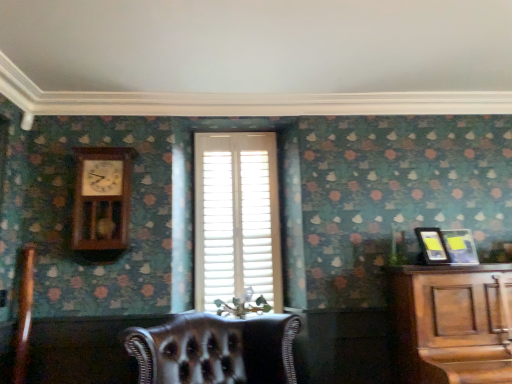
Where is `leather armchair at lower left`? Image resolution: width=512 pixels, height=384 pixels. leather armchair at lower left is located at coordinates (24, 316).

The width and height of the screenshot is (512, 384). In order to click on matte black picture frame at right, which is counted as the second picture frame, starting from the right in this screenshot , I will do `click(432, 246)`.

What is the approximate width of white wood blinds at center?

2.74 inches.

What is the approximate width of metallic silver picture frame at right, the second picture frame in the left-to-right sequence?

The width of metallic silver picture frame at right, the second picture frame in the left-to-right sequence, is 6.14 inches.

Where is `leather at center`? The width and height of the screenshot is (512, 384). leather at center is located at coordinates (215, 350).

What do you see at coordinates (102, 198) in the screenshot?
I see `wooden pendulum clock at upper left` at bounding box center [102, 198].

Find the location of a particular element. The height and width of the screenshot is (384, 512). leather armchair at lower left is located at coordinates (24, 316).

Is metallic silver picture frame at right, which is the 1th picture frame from right to left, far away from matte black picture frame at right, arranged as the 1th picture frame when viewed from the left?

No, metallic silver picture frame at right, which is the 1th picture frame from right to left, is not far away from matte black picture frame at right, arranged as the 1th picture frame when viewed from the left.

Which is in front, metallic silver picture frame at right, the second picture frame in the left-to-right sequence, or matte black picture frame at right, which is counted as the second picture frame, starting from the right?

matte black picture frame at right, which is counted as the second picture frame, starting from the right, is more forward.

At what (x,y) coordinates should I click in order to perform the action: click on picture frame lying on the left of metallic silver picture frame at right, the second picture frame in the left-to-right sequence. Please return your answer as a coordinate pair (x, y). Looking at the image, I should click on (432, 246).

Measure the distance from metallic silver picture frame at right, the second picture frame in the left-to-right sequence, to matte black picture frame at right, which is counted as the second picture frame, starting from the right.

They are 7.86 inches apart.

Is leather at center placed right next to white wood blinds at center?

leather at center and white wood blinds at center are clearly separated.

Is leather at center outside of white wood blinds at center?

Indeed, leather at center is completely outside white wood blinds at center.

Locate an element on the screen. window that is on the left side of leather at center is located at coordinates (236, 218).

Between leather at center and white wood blinds at center, which one has less height?

leather at center.

Who is bigger, matte black picture frame at right, arranged as the 1th picture frame when viewed from the left, or leather at center?

leather at center.

Does matte black picture frame at right, which is counted as the second picture frame, starting from the right, contain leather at center?

No.

Looking at this image, based on their positions, is matte black picture frame at right, which is counted as the second picture frame, starting from the right, located to the left or right of leather at center?

Clearly, matte black picture frame at right, which is counted as the second picture frame, starting from the right, is on the right of leather at center in the image.

How many degrees apart are the facing directions of matte black picture frame at right, arranged as the 1th picture frame when viewed from the left, and leather at center?

There is a 13.4-degree angle between the facing directions of matte black picture frame at right, arranged as the 1th picture frame when viewed from the left, and leather at center.

From a real-world perspective, which object rests below the other?

From a 3D spatial view, leather at center is below.

At what (x,y) coordinates should I click in order to perform the action: click on clock above the leather at center (from the image's perspective). Please return your answer as a coordinate pair (x, y). Looking at the image, I should click on (102, 198).

Is wooden pendulum clock at upper left facing towards leather at center?

No.

Can you tell me how much wooden pendulum clock at upper left and leather at center differ in facing direction?

28.1 degrees separate the facing orientations of wooden pendulum clock at upper left and leather at center.

How different are the orientations of leather at center and metallic silver picture frame at right, the second picture frame in the left-to-right sequence, in degrees?

The angle between the facing direction of leather at center and the facing direction of metallic silver picture frame at right, the second picture frame in the left-to-right sequence, is 22.3 degrees.

Considering the relative sizes of leather at center and metallic silver picture frame at right, which is the 1th picture frame from right to left, in the image provided, is leather at center bigger than metallic silver picture frame at right, which is the 1th picture frame from right to left,?

Correct, leather at center is larger in size than metallic silver picture frame at right, which is the 1th picture frame from right to left.

Is metallic silver picture frame at right, the second picture frame in the left-to-right sequence, inside leather at center?

Actually, metallic silver picture frame at right, the second picture frame in the left-to-right sequence, is outside leather at center.

The image size is (512, 384). Identify the location of chair located in front of the metallic silver picture frame at right, the second picture frame in the left-to-right sequence. (215, 350).

Considering the relative sizes of wooden pendulum clock at upper left and matte black picture frame at right, arranged as the 1th picture frame when viewed from the left, in the image provided, is wooden pendulum clock at upper left thinner than matte black picture frame at right, arranged as the 1th picture frame when viewed from the left,?

Result: No.

In the image, is wooden pendulum clock at upper left on the left side or the right side of matte black picture frame at right, arranged as the 1th picture frame when viewed from the left?

From the image, it's evident that wooden pendulum clock at upper left is to the left of matte black picture frame at right, arranged as the 1th picture frame when viewed from the left.

How many degrees apart are the facing directions of wooden pendulum clock at upper left and matte black picture frame at right, arranged as the 1th picture frame when viewed from the left?

The angle between the facing direction of wooden pendulum clock at upper left and the facing direction of matte black picture frame at right, arranged as the 1th picture frame when viewed from the left, is 14.7 degrees.

Can you tell me how much matte black picture frame at right, which is counted as the second picture frame, starting from the right, and metallic silver picture frame at right, which is the 1th picture frame from right to left, differ in facing direction?

matte black picture frame at right, which is counted as the second picture frame, starting from the right, and metallic silver picture frame at right, which is the 1th picture frame from right to left, are facing 8.85 degrees away from each other.

Does matte black picture frame at right, arranged as the 1th picture frame when viewed from the left, have a lesser height compared to metallic silver picture frame at right, which is the 1th picture frame from right to left?

Incorrect, the height of matte black picture frame at right, arranged as the 1th picture frame when viewed from the left, does not fall short of that of metallic silver picture frame at right, which is the 1th picture frame from right to left.

Considering the positions of objects matte black picture frame at right, arranged as the 1th picture frame when viewed from the left, and metallic silver picture frame at right, which is the 1th picture frame from right to left, in the image provided, who is more to the right, matte black picture frame at right, arranged as the 1th picture frame when viewed from the left, or metallic silver picture frame at right, which is the 1th picture frame from right to left,?

metallic silver picture frame at right, which is the 1th picture frame from right to left, is more to the right.

Where is `picture frame in front of the metallic silver picture frame at right, the second picture frame in the left-to-right sequence`? Image resolution: width=512 pixels, height=384 pixels. picture frame in front of the metallic silver picture frame at right, the second picture frame in the left-to-right sequence is located at coordinates (432, 246).

I want to click on window on the left of the leather at center, so click(x=236, y=218).

Which object lies further to the anchor point leather armchair at lower left, white wood blinds at center or matte black picture frame at right, arranged as the 1th picture frame when viewed from the left?

matte black picture frame at right, arranged as the 1th picture frame when viewed from the left, lies further to leather armchair at lower left than the other object.

When comparing their distances from leather armchair at lower left, does metallic silver picture frame at right, the second picture frame in the left-to-right sequence, or wooden pendulum clock at upper left seem closer?

wooden pendulum clock at upper left is positioned closer to the anchor leather armchair at lower left.

From the image, which object appears to be farther from matte black picture frame at right, arranged as the 1th picture frame when viewed from the left, white wood blinds at center or leather at center?

leather at center.

Based on their spatial positions, is leather armchair at lower left or white wood blinds at center closer to metallic silver picture frame at right, which is the 1th picture frame from right to left?

white wood blinds at center lies closer to metallic silver picture frame at right, which is the 1th picture frame from right to left, than the other object.

When comparing their distances from metallic silver picture frame at right, the second picture frame in the left-to-right sequence, does wooden pendulum clock at upper left or white wood blinds at center seem closer?

The object closer to metallic silver picture frame at right, the second picture frame in the left-to-right sequence, is white wood blinds at center.

In the scene shown: From the image, which object appears to be farther from white wood blinds at center, matte black picture frame at right, arranged as the 1th picture frame when viewed from the left, or leather armchair at lower left?

leather armchair at lower left.

Consider the image. Estimate the real-world distances between objects in this image. Which object is closer to leather at center, metallic silver picture frame at right, the second picture frame in the left-to-right sequence, or white wood blinds at center?

The object closer to leather at center is white wood blinds at center.

Estimate the real-world distances between objects in this image. Which object is closer to leather at center, wooden pendulum clock at upper left or leather armchair at lower left?

wooden pendulum clock at upper left lies closer to leather at center than the other object.

Locate an element on the screen. clock between leather armchair at lower left and matte black picture frame at right, which is counted as the second picture frame, starting from the right is located at coordinates (102, 198).

This screenshot has width=512, height=384. Identify the location of chair between wooden pendulum clock at upper left and metallic silver picture frame at right, the second picture frame in the left-to-right sequence. (215, 350).

Locate an element on the screen. This screenshot has height=384, width=512. picture frame between leather at center and metallic silver picture frame at right, which is the 1th picture frame from right to left is located at coordinates (432, 246).

You are a GUI agent. You are given a task and a screenshot of the screen. Output one action in this format:
    pyautogui.click(x=<x>, y=<y>)
    Task: Click on the picture frame between wooden pendulum clock at upper left and metallic silver picture frame at right, which is the 1th picture frame from right to left, from left to right
    The height and width of the screenshot is (384, 512).
    Given the screenshot: What is the action you would take?
    pyautogui.click(x=432, y=246)